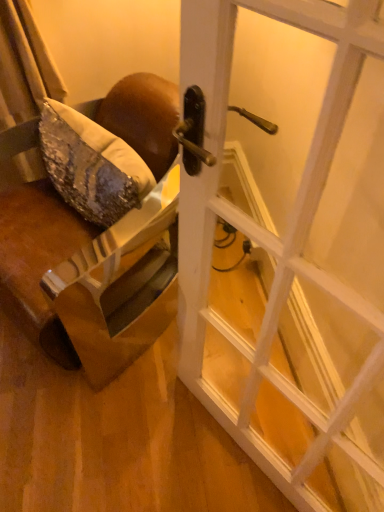
Question: Based on their sizes in the image, would you say brown leather chair at left is bigger or smaller than white glossy door at center?

Choices:
 (A) small
 (B) big

Answer: (B)

Question: From a real-world perspective, relative to white glossy door at center, is brown leather chair at left vertically above or below?

Choices:
 (A) below
 (B) above

Answer: (A)

Question: Is point (129, 118) closer or farther from the camera than point (337, 98)?

Choices:
 (A) farther
 (B) closer

Answer: (A)

Question: Which is correct: white glossy door at center is inside brown leather chair at left, or outside of it?

Choices:
 (A) outside
 (B) inside

Answer: (A)

Question: Is white glossy door at center to the left or to the right of brown leather chair at left in the image?

Choices:
 (A) right
 (B) left

Answer: (A)

Question: From their relative heights in the image, would you say white glossy door at center is taller or shorter than brown leather chair at left?

Choices:
 (A) short
 (B) tall

Answer: (B)

Question: From the image's perspective, is white glossy door at center above or below brown leather chair at left?

Choices:
 (A) below
 (B) above

Answer: (A)